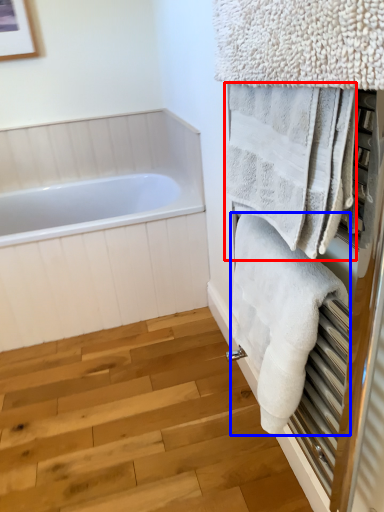
Question: Which of the following is the closest to the observer, towel (highlighted by a red box) or towel (highlighted by a blue box)?

Choices:
 (A) towel
 (B) towel

Answer: (A)